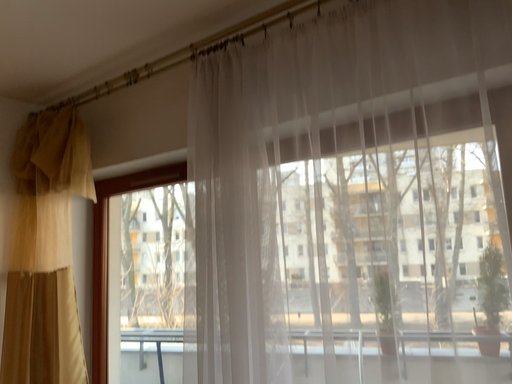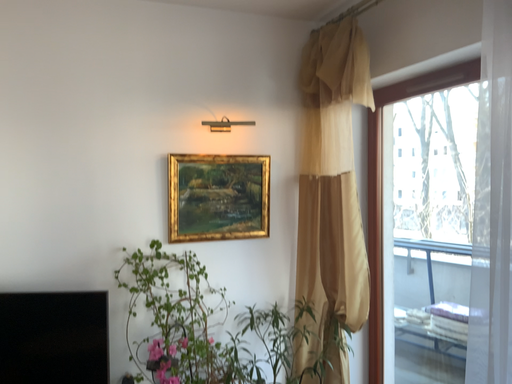
Question: Which way did the camera rotate in the video?

Choices:
 (A) rotated upward
 (B) rotated downward

Answer: (B)